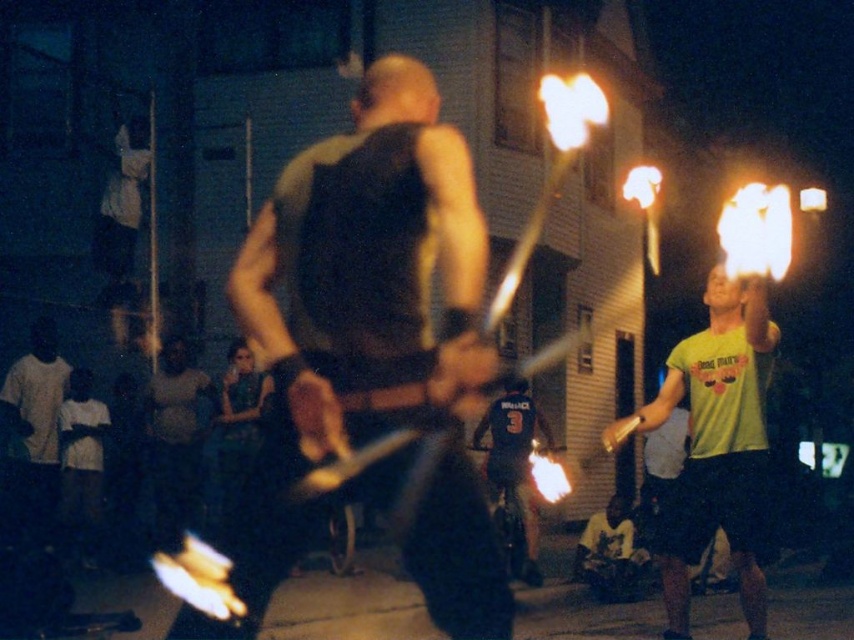
Can you confirm if dark gray tank top at center is shorter than green matte t-shirt at right?

No.

The width and height of the screenshot is (854, 640). Describe the element at coordinates (354, 308) in the screenshot. I see `dark gray tank top at center` at that location.

Does point (490, 540) come farther from viewer compared to point (767, 358)?

That is False.

In order to click on dark gray tank top at center in this screenshot , I will do `click(354, 308)`.

Is green matte t-shirt at right wider than dark blue jersey at center?

Correct, the width of green matte t-shirt at right exceeds that of dark blue jersey at center.

Can you confirm if green matte t-shirt at right is taller than dark blue jersey at center?

Yes, green matte t-shirt at right is taller than dark blue jersey at center.

Identify the location of green matte t-shirt at right. The height and width of the screenshot is (640, 854). (715, 445).

Identify the location of green matte t-shirt at right. (715, 445).

Can you confirm if dark gray tank top at center is shorter than dark blue jersey at center?

Incorrect, dark gray tank top at center's height does not fall short of dark blue jersey at center's.

Between dark gray tank top at center and dark blue jersey at center, which one has less height?

dark blue jersey at center

Does point (268, 314) come farther from viewer compared to point (529, 584)?

No.

The width and height of the screenshot is (854, 640). In order to click on dark gray tank top at center in this screenshot , I will do `click(354, 308)`.